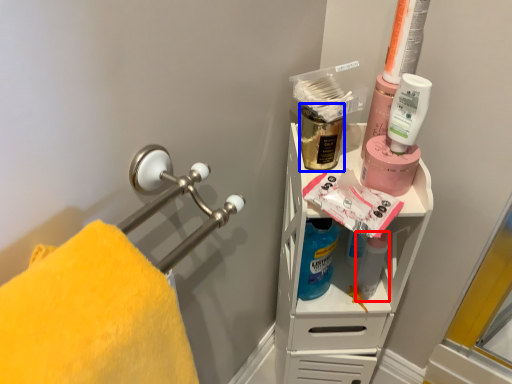
Question: Which of the following is the farthest to the observer, cleaning product (highlighted by a red box) or mouthwash (highlighted by a blue box)?

Choices:
 (A) cleaning product
 (B) mouthwash

Answer: (A)